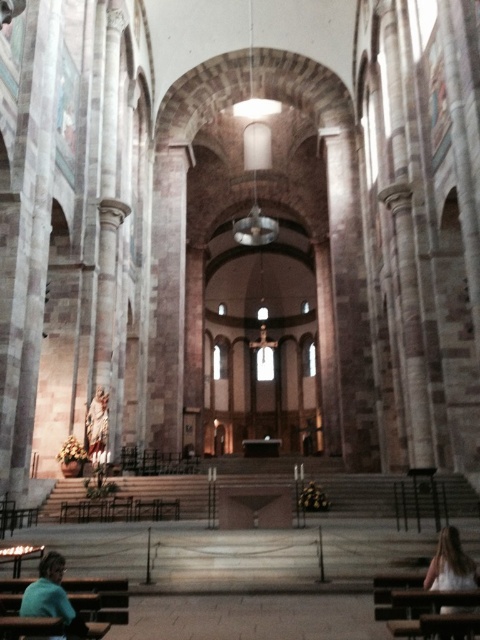
Question: Which is nearer to the teal fabric shirt at lower left?

Choices:
 (A) matte stone statue at center
 (B) blonde hair at lower right

Answer: (B)

Question: Among these points, which one is nearest to the camera?

Choices:
 (A) (94, 451)
 (B) (60, 561)

Answer: (B)

Question: Which point is farther to the camera?

Choices:
 (A) (50, 616)
 (B) (472, 588)

Answer: (B)

Question: Can you confirm if teal fabric shirt at lower left is positioned to the left of blonde hair at lower right?

Choices:
 (A) no
 (B) yes

Answer: (B)

Question: Can you confirm if blonde hair at lower right is positioned to the right of matte stone statue at center?

Choices:
 (A) no
 (B) yes

Answer: (B)

Question: Can you confirm if blonde hair at lower right is bigger than matte stone statue at center?

Choices:
 (A) yes
 (B) no

Answer: (A)